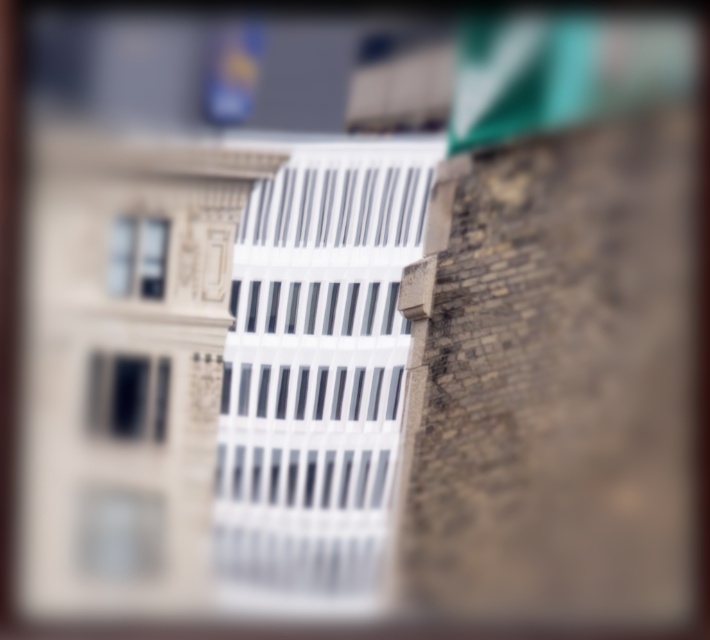
You are an interior designer assessing a room with a matte black window at center and a clear glass window at upper left. Which window has a greater width according to the spatial details?

The matte black window at center has a greater width than the clear glass window at upper left.

You are standing in the scene and want to reach both the point at coordinates (151, 364) and the point at (151, 228). Which point will you reach first?

You will reach point (151, 364) first because it is closer to you than point (151, 228).

You are standing outside the building and want to look through the windows to see the interior. Which window, the matte black window at center or the clear glass window at upper left, would allow you to see inside more clearly?

The clear glass window at upper left allows for clearer visibility since it is made of clear glass, unlike the matte black window at center which is likely frosted or tinted.